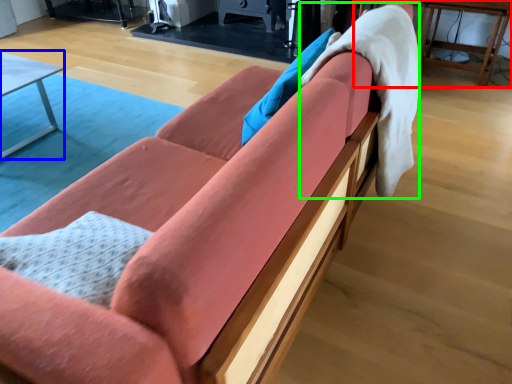
Question: Which is nearer to the table (highlighted by a red box)? table (highlighted by a blue box) or blanket (highlighted by a green box).

Choices:
 (A) table
 (B) blanket

Answer: (B)